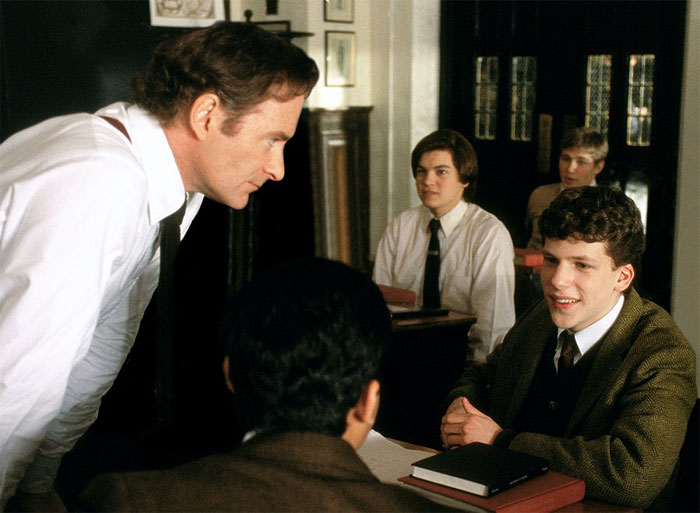
Where is `glass panels on doors`? This screenshot has width=700, height=513. glass panels on doors is located at coordinates (512, 83), (482, 83), (592, 84), (631, 95).